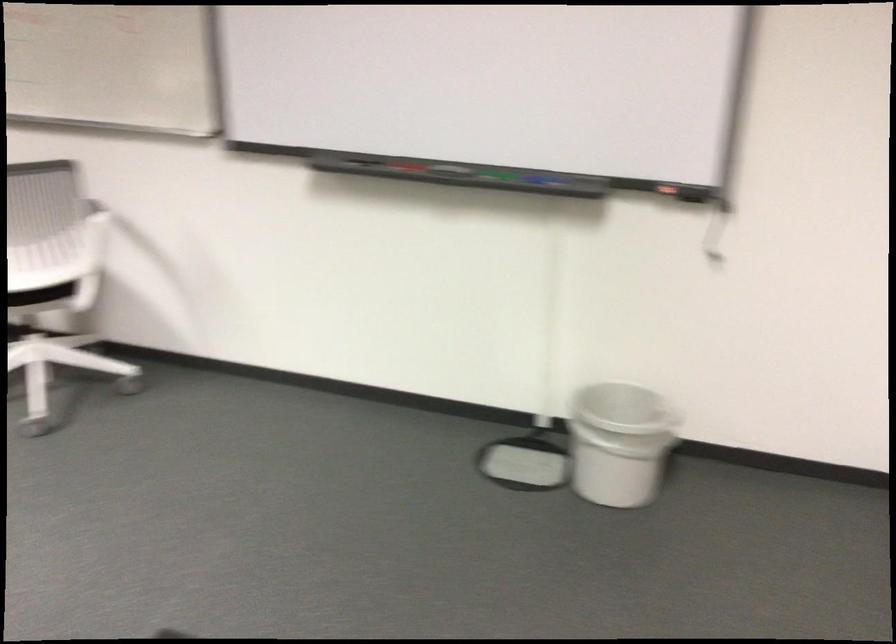
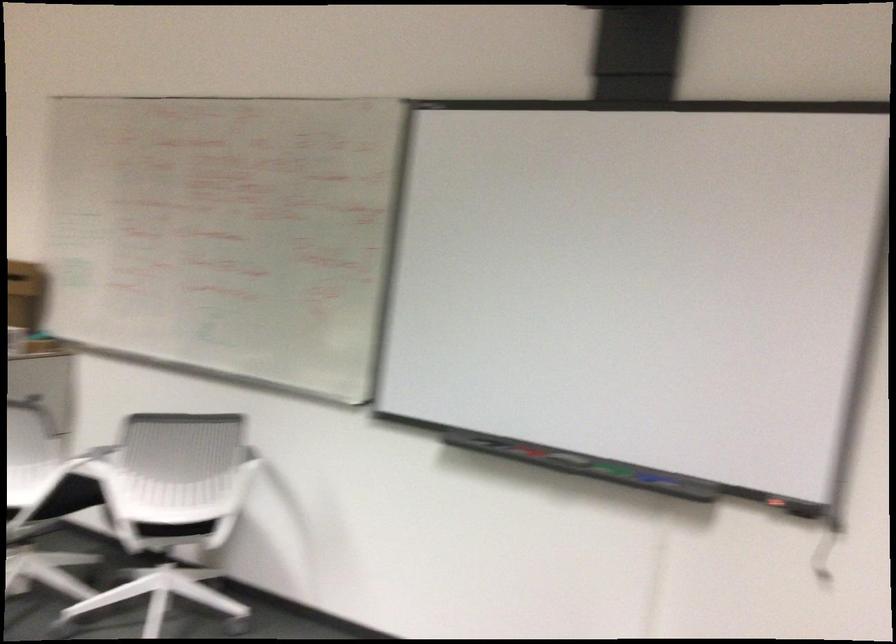
Locate, in the second image, the point that corresponds to point (495, 173) in the first image.

(613, 469)